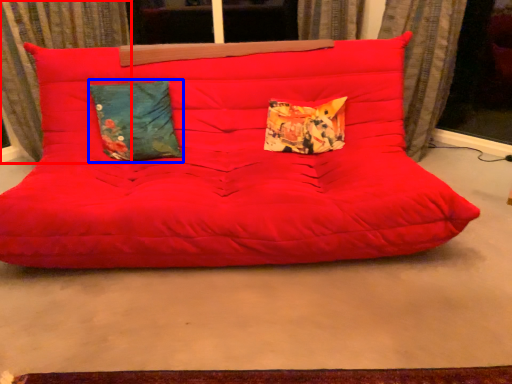
Question: Which object is further to the camera taking this photo, curtain (highlighted by a red box) or pillow (highlighted by a blue box)?

Choices:
 (A) curtain
 (B) pillow

Answer: (A)